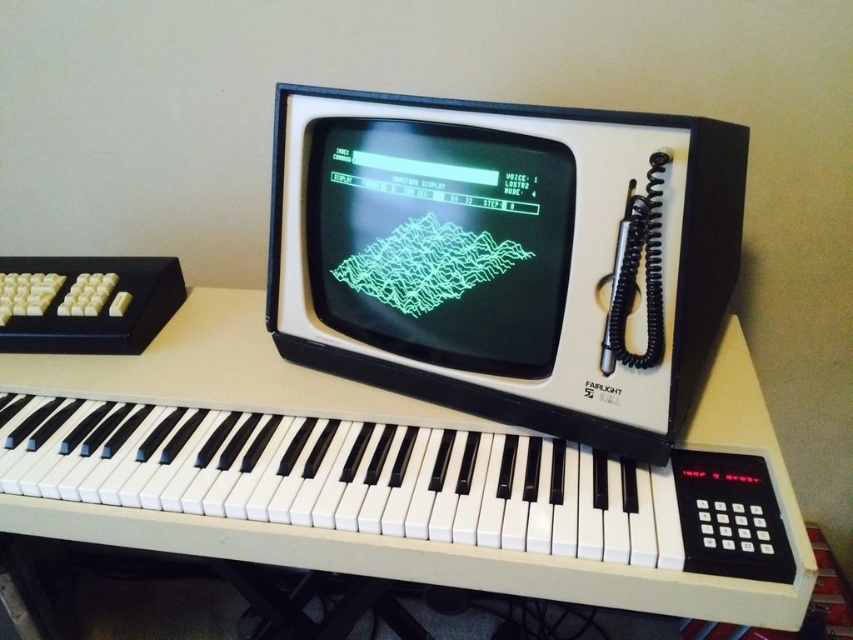
Which is more to the right, white plastic piano at center or matte black monitor at center?

matte black monitor at center

Image resolution: width=853 pixels, height=640 pixels. What do you see at coordinates (375, 476) in the screenshot? I see `white plastic piano at center` at bounding box center [375, 476].

Where is `white plastic piano at center`? Image resolution: width=853 pixels, height=640 pixels. white plastic piano at center is located at coordinates (375, 476).